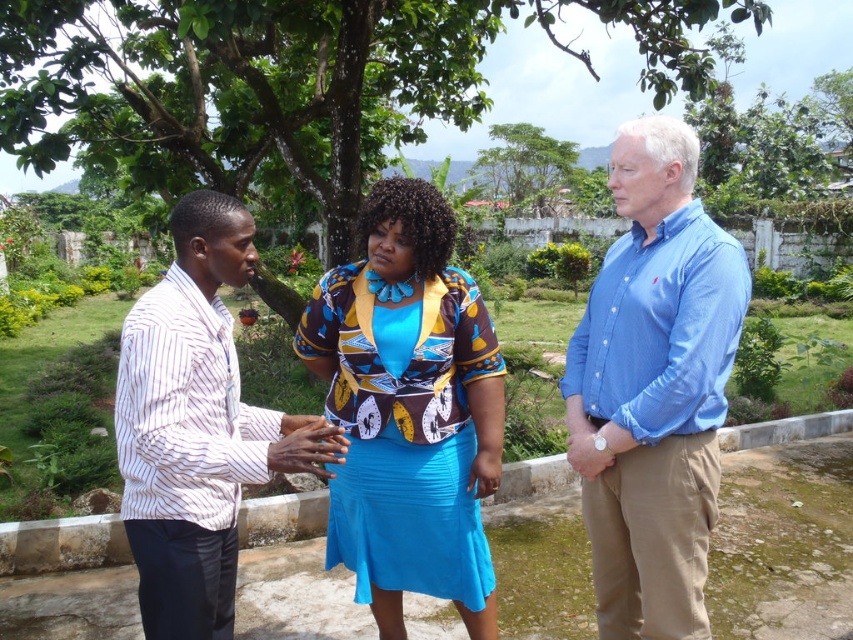
Question: Is blue cotton shirt at right to the right of blue fabric skirt at center from the viewer's perspective?

Choices:
 (A) yes
 (B) no

Answer: (A)

Question: Among these objects, which one is nearest to the camera?

Choices:
 (A) blue fabric skirt at center
 (B) white striped shirt at left

Answer: (B)

Question: Which of the following is the closest to the observer?

Choices:
 (A) blue cotton shirt at right
 (B) green leafy tree at upper center

Answer: (A)

Question: Can you confirm if green leafy tree at center is smaller than blue cotton shirt at right?

Choices:
 (A) yes
 (B) no

Answer: (B)

Question: Based on their relative distances, which object is nearer to the blue cotton shirt at right?

Choices:
 (A) green leafy tree at upper center
 (B) green leafy tree at center

Answer: (B)

Question: Can you confirm if green leafy tree at center is positioned to the left of white striped shirt at left?

Choices:
 (A) yes
 (B) no

Answer: (B)